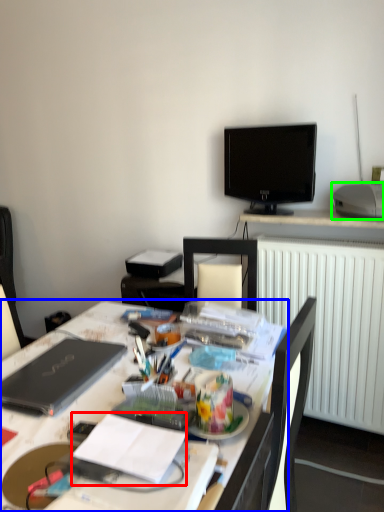
Question: Based on their relative distances, which object is nearer to notebook (highlighted by a red box)? Choose from desk (highlighted by a blue box) and printer (highlighted by a green box).

Choices:
 (A) desk
 (B) printer

Answer: (A)